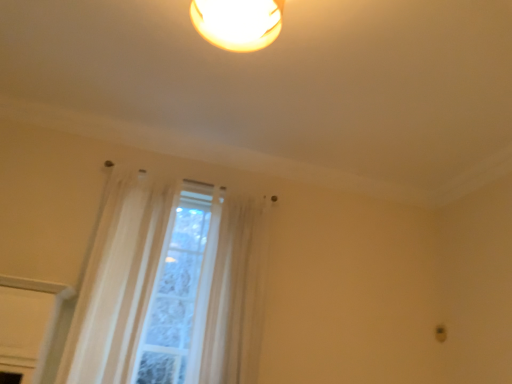
Question: In terms of size, does white sheer curtain at center, the first curtain when ordered from left to right, appear bigger or smaller than sheer white curtain at center, the 1th curtain positioned from the right?

Choices:
 (A) small
 (B) big

Answer: (A)

Question: Does point (168, 306) appear closer or farther from the camera than point (237, 309)?

Choices:
 (A) farther
 (B) closer

Answer: (A)

Question: From a real-world perspective, is white sheer curtain at center, positioned as the 2th curtain in right-to-left order, physically located above or below sheer white curtain at center, which appears as the second curtain when viewed from the left?

Choices:
 (A) below
 (B) above

Answer: (A)

Question: In the image, is sheer white curtain at center, the 1th curtain positioned from the right, positioned in front of or behind white sheer curtain at center, positioned as the 2th curtain in right-to-left order?

Choices:
 (A) behind
 (B) front

Answer: (A)

Question: Do you think sheer white curtain at center, the 1th curtain positioned from the right, is within white sheer curtain at center, the first curtain when ordered from left to right, or outside of it?

Choices:
 (A) inside
 (B) outside

Answer: (B)

Question: In terms of width, does sheer white curtain at center, the 1th curtain positioned from the right, look wider or thinner when compared to white sheer curtain at center, positioned as the 2th curtain in right-to-left order?

Choices:
 (A) thin
 (B) wide

Answer: (B)

Question: In terms of height, does sheer white curtain at center, the 1th curtain positioned from the right, look taller or shorter compared to white sheer curtain at center, the first curtain when ordered from left to right?

Choices:
 (A) tall
 (B) short

Answer: (B)